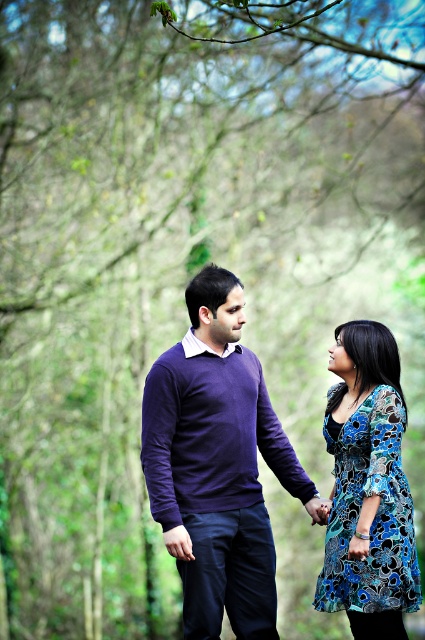
Between purple sweater at center and blue floral dress at center, which one appears on the left side from the viewer's perspective?

Positioned to the left is purple sweater at center.

Does purple sweater at center have a larger size compared to blue floral dress at center?

Yes, purple sweater at center is bigger than blue floral dress at center.

Identify the location of purple sweater at center. (217, 465).